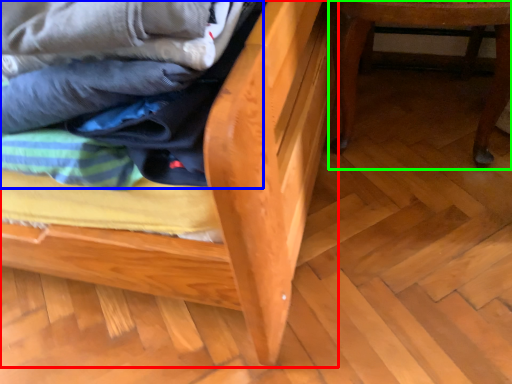
Question: Which object is positioned farthest from furniture (highlighted by a red box)? Select from laundry (highlighted by a blue box) and furniture (highlighted by a green box).

Choices:
 (A) laundry
 (B) furniture

Answer: (B)